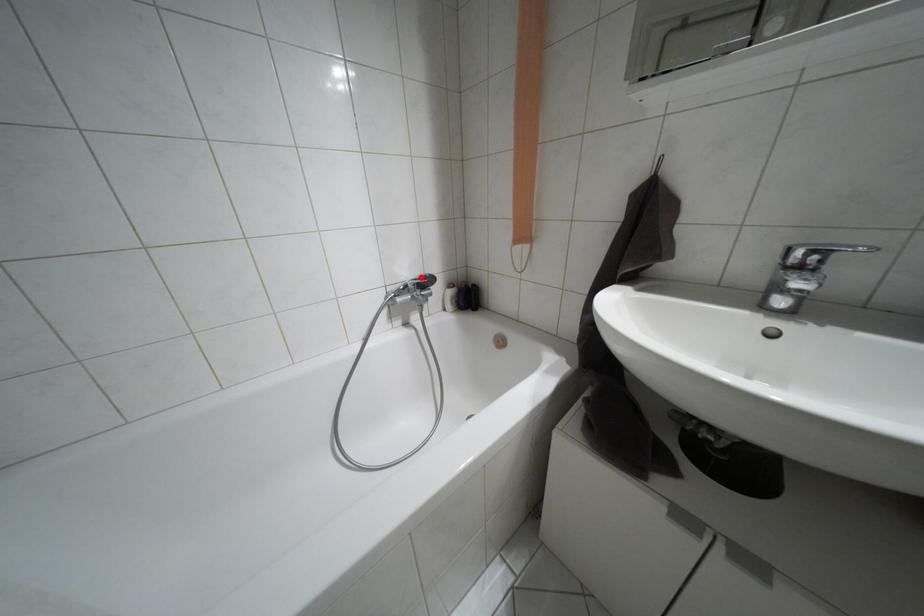
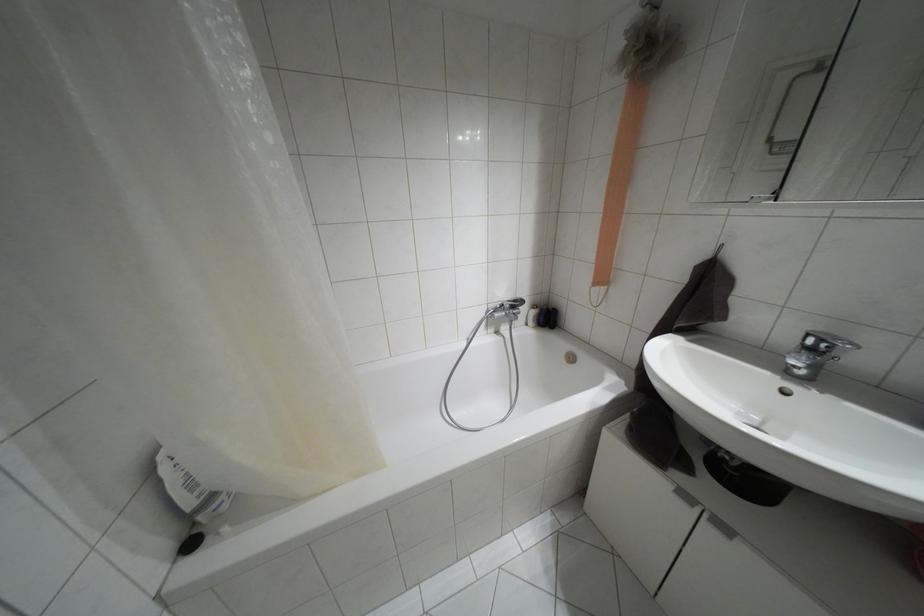
Where in the second image is the point corresponding to the highlighted location from the first image?

(514, 301)